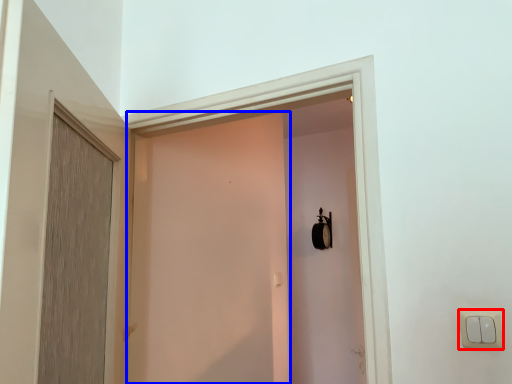
Question: Which of the following is the farthest to the observer, light switch (highlighted by a red box) or screen door (highlighted by a blue box)?

Choices:
 (A) light switch
 (B) screen door

Answer: (B)